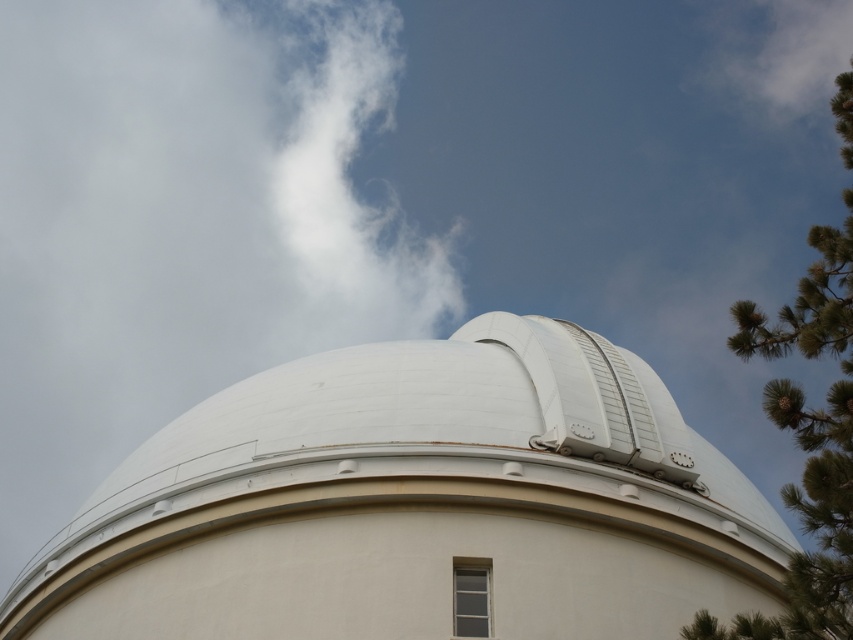
Identify the location of white smooth dome at center. This screenshot has width=853, height=640. (416, 504).

Which is below, white smooth dome at center or white fluffy cloud at upper left?

white smooth dome at center is lower down.

Image resolution: width=853 pixels, height=640 pixels. What do you see at coordinates (416, 504) in the screenshot? I see `white smooth dome at center` at bounding box center [416, 504].

Image resolution: width=853 pixels, height=640 pixels. I want to click on white smooth dome at center, so click(416, 504).